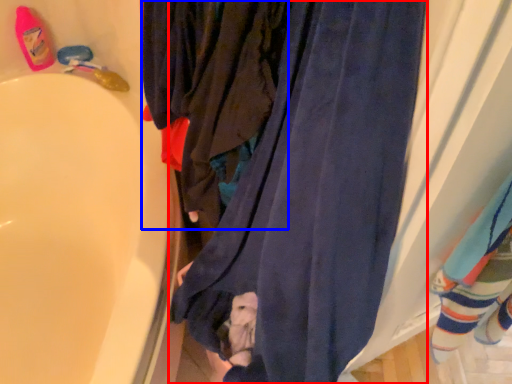
Question: Which of the following is the closest to the observer, curtain (highlighted by a red box) or clothing (highlighted by a blue box)?

Choices:
 (A) curtain
 (B) clothing

Answer: (A)